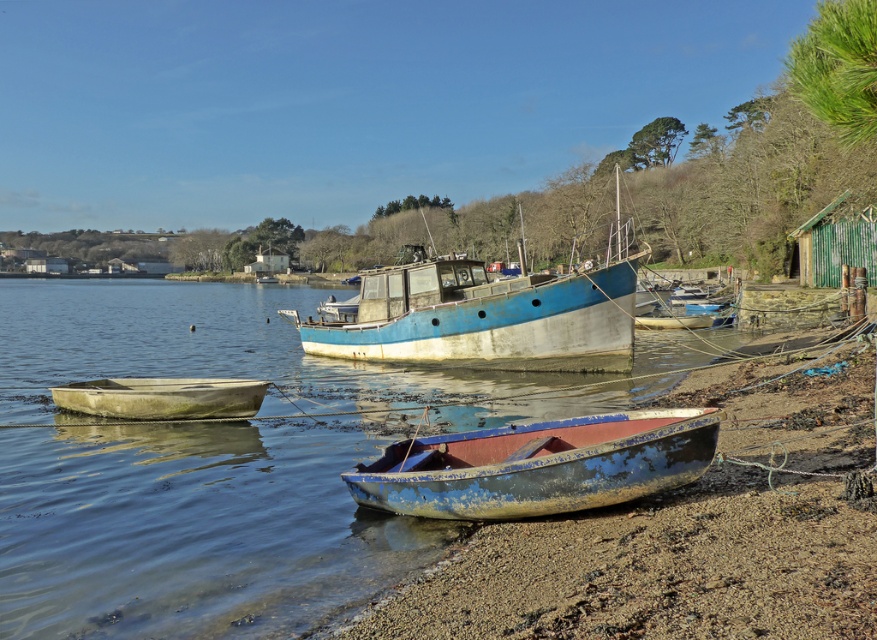
Question: Where is blue weathered canoe at lower center located in relation to white weathered canoe at lower left in the image?

Choices:
 (A) below
 (B) above

Answer: (A)

Question: Where is blue weathered boat at center located in relation to blue weathered canoe at lower center in the image?

Choices:
 (A) above
 (B) below

Answer: (A)

Question: Which object is positioned farthest from the blue weathered boat at center?

Choices:
 (A) white weathered canoe at lower left
 (B) blue weathered canoe at lower center

Answer: (A)

Question: Which point is farther to the camera?

Choices:
 (A) (84, 404)
 (B) (451, 509)
 (C) (421, 298)

Answer: (C)

Question: From the image, what is the correct spatial relationship of blue weathered boat at center in relation to white weathered canoe at lower left?

Choices:
 (A) left
 (B) right

Answer: (B)

Question: Which of these objects is positioned farthest from the white weathered canoe at lower left?

Choices:
 (A) blue weathered boat at center
 (B) blue weathered canoe at lower center

Answer: (A)